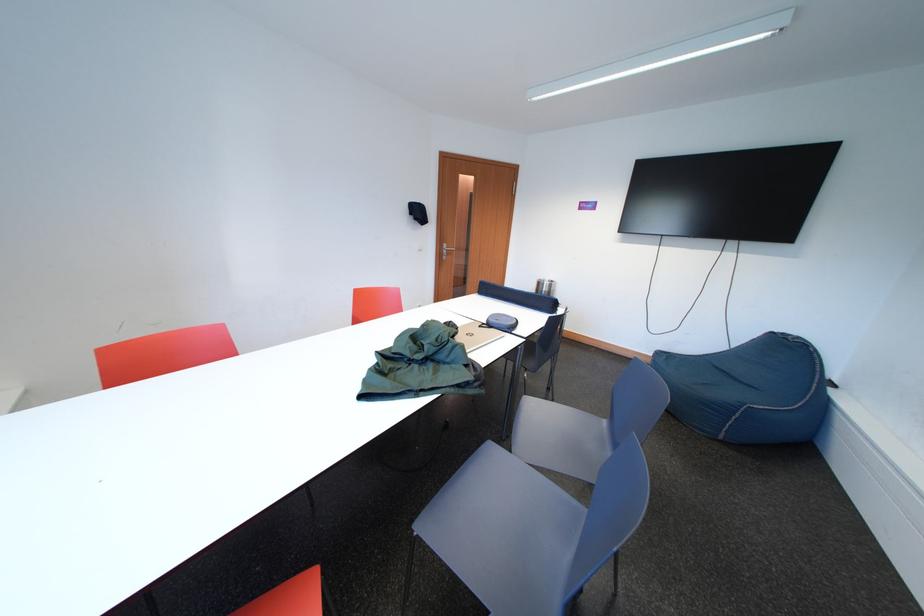
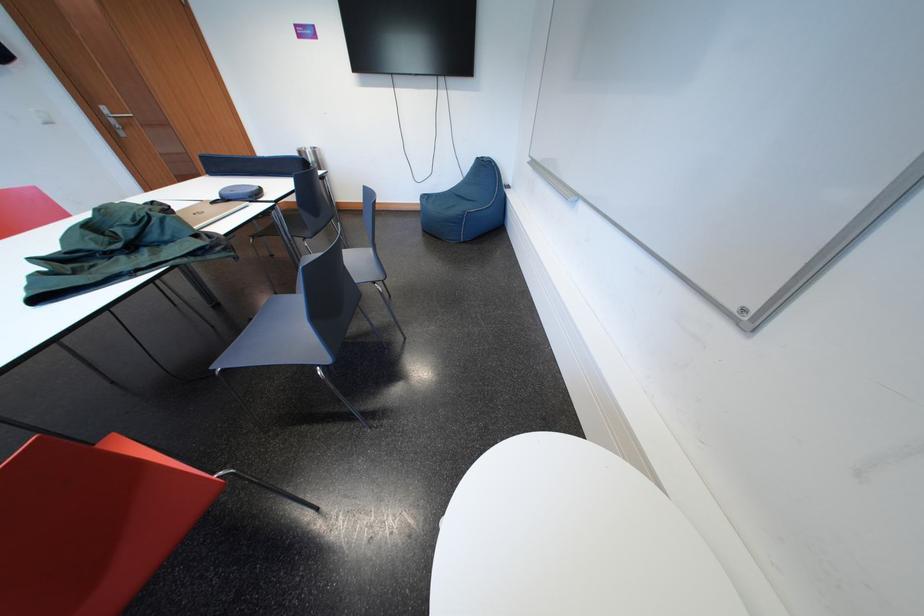
Where in the second image is the point corresponding to point (455, 249) from the first image?

(113, 113)